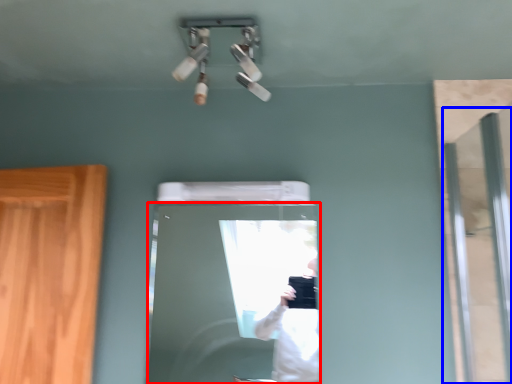
Question: Which object is closer to the camera taking this photo, door (highlighted by a red box) or screen door (highlighted by a blue box)?

Choices:
 (A) door
 (B) screen door

Answer: (B)